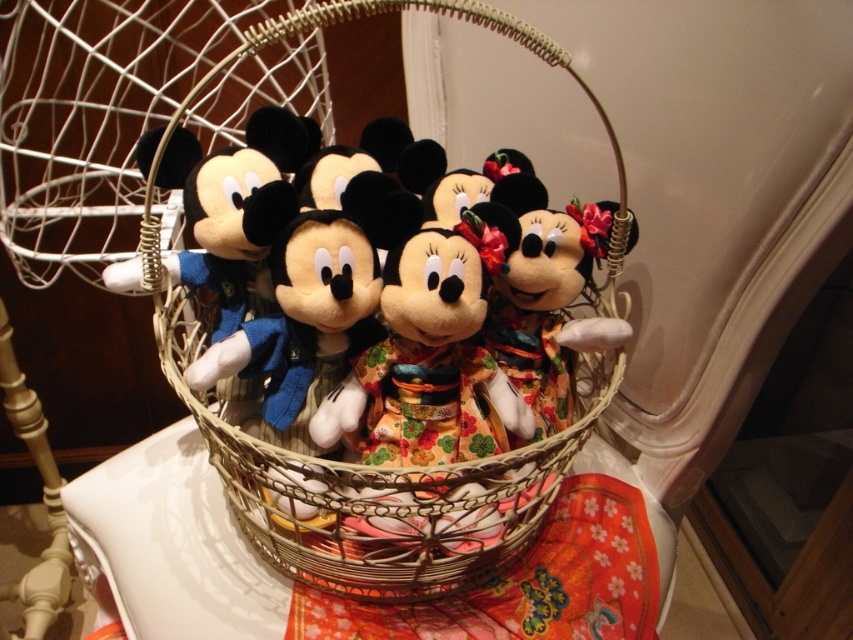
Can you confirm if woven straw basket at center is positioned below white glossy table at center?

Actually, woven straw basket at center is above white glossy table at center.

From the picture: Who is more distant from viewer, (514, 531) or (654, 516)?

Positioned behind is point (654, 516).

Locate an element on the screen. This screenshot has width=853, height=640. woven straw basket at center is located at coordinates (384, 492).